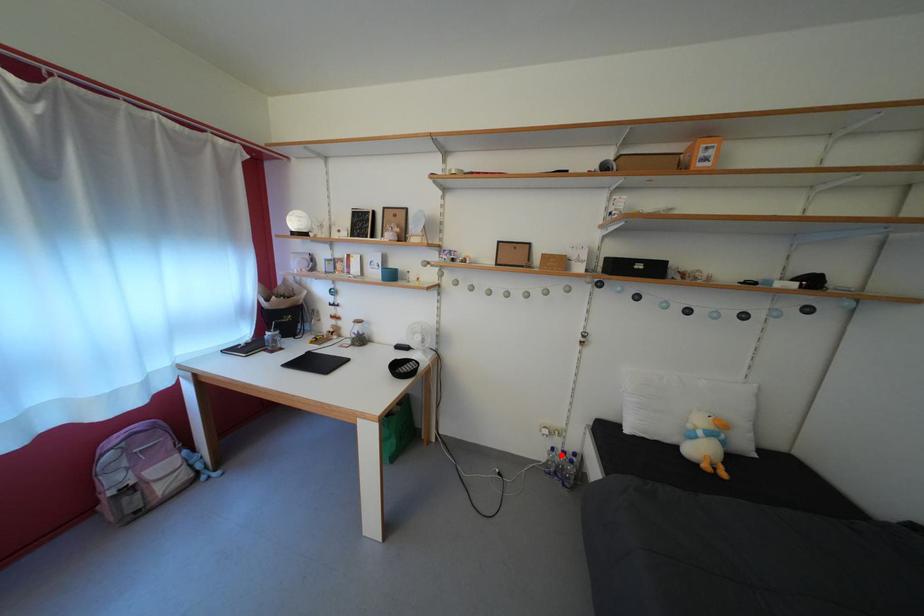
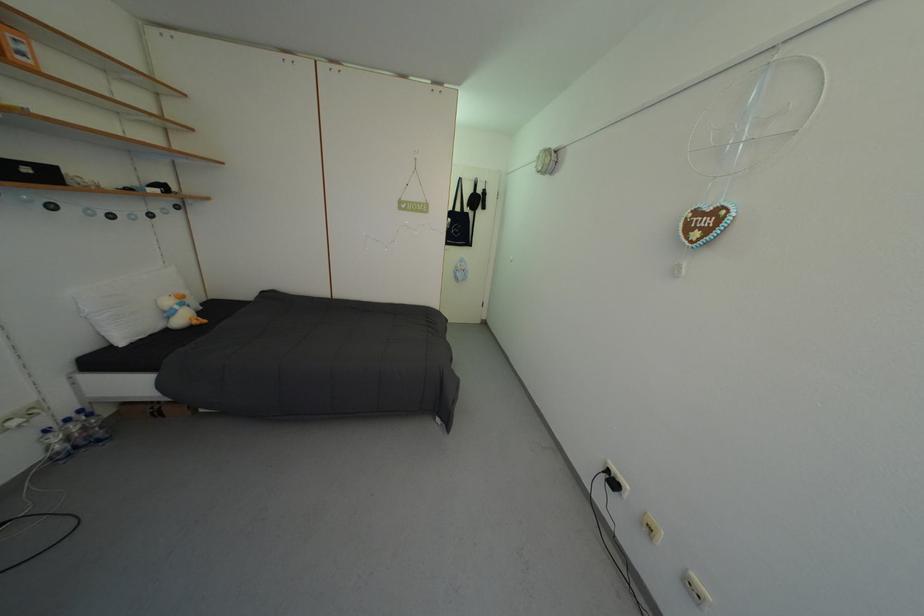
Where in the second image is the point corresponding to the highlighted location from the first image?

(55, 437)